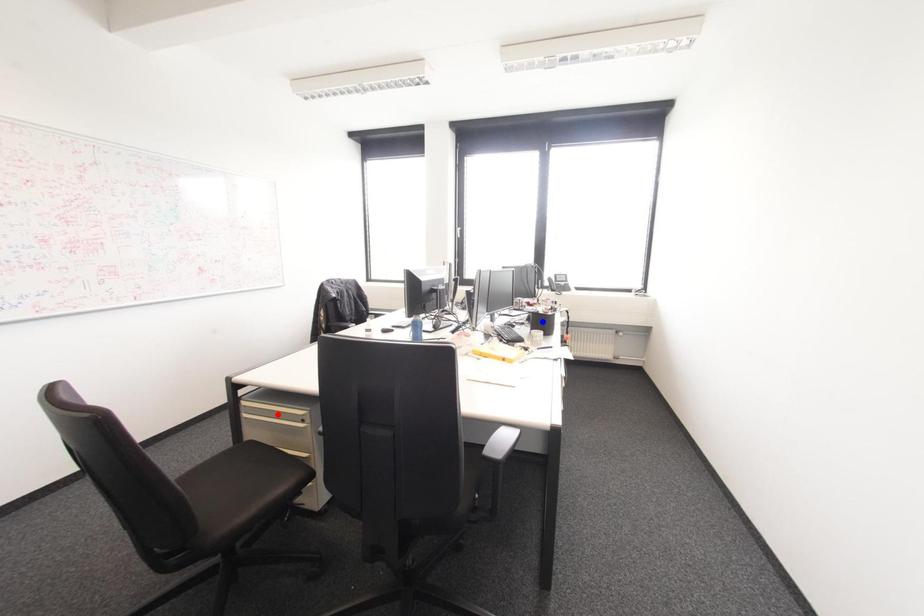
Question: Two points are marked on the image. Which point is closer to the camera?

Choices:
 (A) Blue point is closer.
 (B) Red point is closer.

Answer: (B)